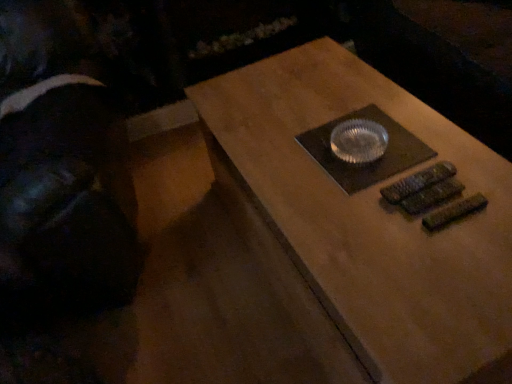
Question: Is black fabric at left placed right next to matte brown table at center?

Choices:
 (A) yes
 (B) no

Answer: (B)

Question: From a real-world perspective, is black fabric at left located beneath matte brown table at center?

Choices:
 (A) yes
 (B) no

Answer: (B)

Question: Is the depth of black fabric at left less than that of matte brown table at center?

Choices:
 (A) no
 (B) yes

Answer: (A)

Question: Is matte brown table at center a part of black fabric at left?

Choices:
 (A) no
 (B) yes

Answer: (A)

Question: Does black fabric at left appear on the right side of matte brown table at center?

Choices:
 (A) yes
 (B) no

Answer: (B)

Question: Is black fabric at left outside of matte brown table at center?

Choices:
 (A) no
 (B) yes

Answer: (B)

Question: Is matte brown table at center smaller than black fabric at left?

Choices:
 (A) yes
 (B) no

Answer: (A)

Question: Can you see matte brown table at center touching black fabric at left?

Choices:
 (A) no
 (B) yes

Answer: (A)

Question: From a real-world perspective, is matte brown table at center on black fabric at left?

Choices:
 (A) no
 (B) yes

Answer: (A)

Question: Does matte brown table at center have a lesser height compared to black fabric at left?

Choices:
 (A) yes
 (B) no

Answer: (A)

Question: Is matte brown table at center at the right side of black fabric at left?

Choices:
 (A) yes
 (B) no

Answer: (A)

Question: Could you tell me if matte brown table at center is facing black fabric at left?

Choices:
 (A) no
 (B) yes

Answer: (A)

Question: Is matte brown table at center wider or thinner than black fabric at left?

Choices:
 (A) wide
 (B) thin

Answer: (A)